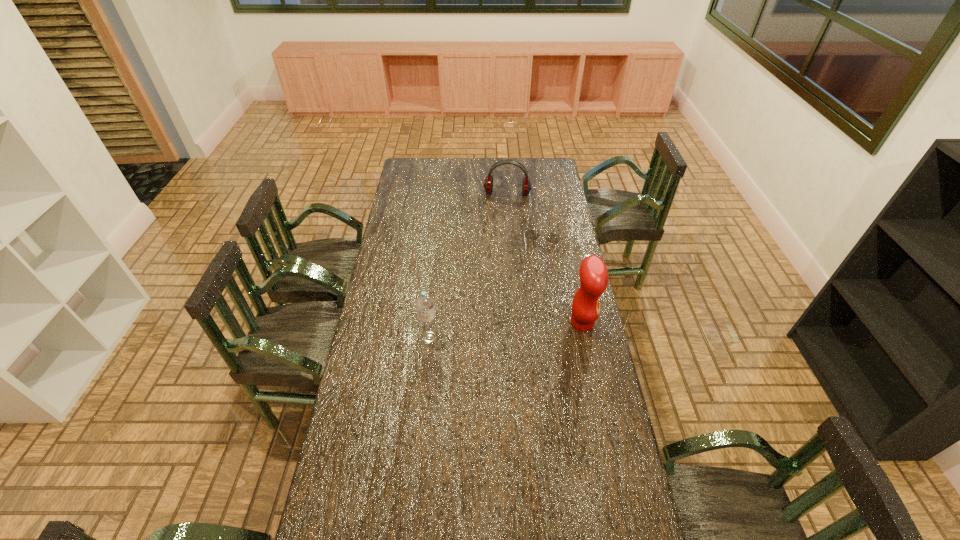
This screenshot has width=960, height=540. I want to click on vacant space on the desktop that is between the third shortest object and the tallest object and is positioned on the ear cups of the farthest object, so click(493, 332).

At what (x,y) coordinates should I click in order to perform the action: click on free space on the desktop that is between the third shortest object and the tallest object and is positioned on the front-facing side of the shortest object. Please return your answer as a coordinate pair (x, y). Looking at the image, I should click on (524, 328).